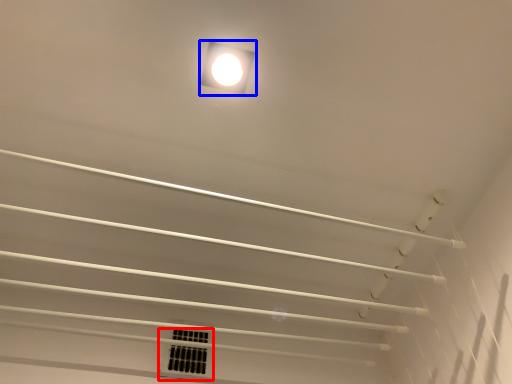
Question: Which object is further to the camera taking this photo, window (highlighted by a red box) or lamp (highlighted by a blue box)?

Choices:
 (A) window
 (B) lamp

Answer: (A)